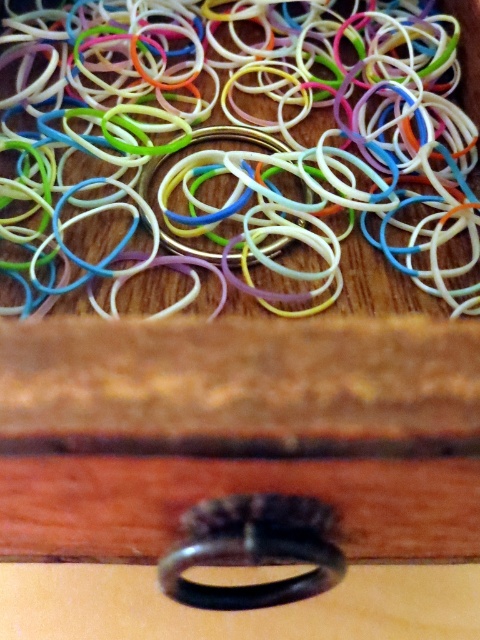
Question: From the image, what is the correct spatial relationship of rubber band at center in relation to black rubber band at center?

Choices:
 (A) below
 (B) above

Answer: (B)

Question: Which point is closer to the camera taking this photo?

Choices:
 (A) (190, 529)
 (B) (88, 180)

Answer: (A)

Question: Is rubber band at center above black rubber band at center?

Choices:
 (A) no
 (B) yes

Answer: (B)

Question: Among these objects, which one is nearest to the camera?

Choices:
 (A) black rubber band at center
 (B) rubber band at center

Answer: (A)

Question: Is rubber band at center to the left of black rubber band at center from the viewer's perspective?

Choices:
 (A) no
 (B) yes

Answer: (B)